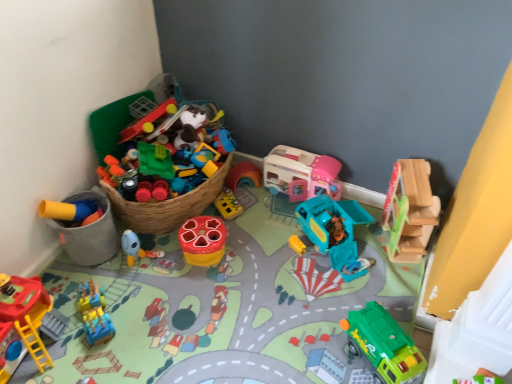
I want to click on free space that is in between pink plastic playhouse at upper right, acting as the fourth toy starting from the right, and rubberized plastic toy at center, positioned as the fourth toy in left-to-right order, so click(253, 221).